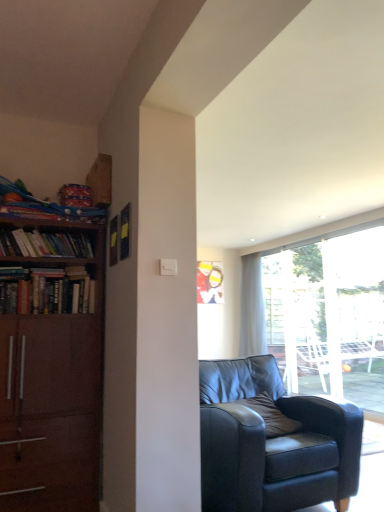
Consider the image. What is the approximate height of white sheer curtain at center?

It is 1.80 meters.

Image resolution: width=384 pixels, height=512 pixels. I want to click on hardcover books at left, which ranks as the first book in top-to-bottom order, so click(44, 244).

Measure the distance between wooden bookshelf at left, positioned as the 2th book in top-to-bottom order, and camera.

8.45 feet.

Find the location of a particular element. The image size is (384, 512). white sheer curtain at center is located at coordinates (252, 308).

Which is less distant, (221, 508) or (85, 249)?

Point (221, 508)

Can you confirm if matte black armchair at center is shorter than hardcover books at left, which is the second book in bottom-to-top order?

Incorrect, the height of matte black armchair at center does not fall short of that of hardcover books at left, which is the second book in bottom-to-top order.

Which is more to the right, matte black armchair at center or hardcover books at left, which ranks as the first book in top-to-bottom order?

matte black armchair at center is more to the right.

Between matte black armchair at center and hardcover books at left, which is the second book in bottom-to-top order, which one has larger size?

Bigger between the two is matte black armchair at center.

From a real-world perspective, is white sheer curtain at center physically located above or below hardcover books at left, which is the second book in bottom-to-top order?

Clearly, from a real-world perspective, white sheer curtain at center is below hardcover books at left, which is the second book in bottom-to-top order.

From the picture: Is white sheer curtain at center oriented towards hardcover books at left, which is the second book in bottom-to-top order?

No, white sheer curtain at center is not oriented towards hardcover books at left, which is the second book in bottom-to-top order.

Between point (252, 320) and point (34, 242), which one is positioned behind?

The point (252, 320) is more distant.

Is white sheer curtain at center next to hardcover books at left, which is the second book in bottom-to-top order?

No, white sheer curtain at center is not next to hardcover books at left, which is the second book in bottom-to-top order.

Between brown leather pillow at center and white sheer curtain at center, which one appears on the left side from the viewer's perspective?

Positioned to the left is brown leather pillow at center.

From the image's perspective, is brown leather pillow at center on white sheer curtain at center?

No.

Looking at this image, is brown leather pillow at center placed right next to white sheer curtain at center?

brown leather pillow at center and white sheer curtain at center are not in contact.

Could you tell me if brown leather pillow at center is facing white sheer curtain at center?

No.

Is hardcover books at left, which ranks as the first book in top-to-bottom order, positioned with its back to wooden bookshelf at left, which is the 1th book in bottom-to-top order?

No, wooden bookshelf at left, which is the 1th book in bottom-to-top order, is not at the back of hardcover books at left, which ranks as the first book in top-to-bottom order.

Where is `book to the right of hardcover books at left, which ranks as the first book in top-to-bottom order`? book to the right of hardcover books at left, which ranks as the first book in top-to-bottom order is located at coordinates (45, 291).

Is wooden bookshelf at left, which is the 1th book in bottom-to-top order, surrounded by hardcover books at left, which ranks as the first book in top-to-bottom order?

No.

Based on the photo, between wooden bookshelf at left, which is the 1th book in bottom-to-top order, and brown leather pillow at center, which one has larger size?

wooden bookshelf at left, which is the 1th book in bottom-to-top order.

Can you confirm if wooden bookshelf at left, which is the 1th book in bottom-to-top order, is positioned to the right of brown leather pillow at center?

No, wooden bookshelf at left, which is the 1th book in bottom-to-top order, is not to the right of brown leather pillow at center.

Considering the sizes of objects wooden bookshelf at left, positioned as the 2th book in top-to-bottom order, and brown leather pillow at center in the image provided, who is wider, wooden bookshelf at left, positioned as the 2th book in top-to-bottom order, or brown leather pillow at center?

With larger width is brown leather pillow at center.

From the picture: Is wooden bookshelf at left, which is the 1th book in bottom-to-top order, shorter than brown leather pillow at center?

Incorrect, the height of wooden bookshelf at left, which is the 1th book in bottom-to-top order, does not fall short of that of brown leather pillow at center.

Considering the sizes of matte black armchair at center and brown leather pillow at center in the image, is matte black armchair at center taller or shorter than brown leather pillow at center?

Considering their sizes, matte black armchair at center has more height than brown leather pillow at center.

Is matte black armchair at center touching brown leather pillow at center?

No, matte black armchair at center is not touching brown leather pillow at center.

From the image's perspective, which is below, matte black armchair at center or brown leather pillow at center?

From the image's view, matte black armchair at center is below.

What's the angular difference between matte black armchair at center and brown leather pillow at center's facing directions?

There is a 5.37-degree angle between the facing directions of matte black armchair at center and brown leather pillow at center.

From the image's perspective, would you say matte black armchair at center is shown under wooden bookshelf at left, which is the 1th book in bottom-to-top order?

Indeed, from the image's perspective, matte black armchair at center is shown beneath wooden bookshelf at left, which is the 1th book in bottom-to-top order.

Between matte black armchair at center and wooden bookshelf at left, which is the 1th book in bottom-to-top order, which one appears on the right side from the viewer's perspective?

Positioned to the right is matte black armchair at center.

Which of these two, matte black armchair at center or wooden bookshelf at left, which is the 1th book in bottom-to-top order, is smaller?

wooden bookshelf at left, which is the 1th book in bottom-to-top order, is smaller.

In order to click on chair lying below the hardcover books at left, which ranks as the first book in top-to-bottom order (from the image's perspective) in this screenshot , I will do `click(273, 442)`.

This screenshot has height=512, width=384. What are the coordinates of `the 2nd book above when counting from the white sheer curtain at center (from the image's perspective)` in the screenshot? It's located at (44, 244).

Looking at the image, which one is located closer to brown leather pillow at center, hardcover books at left, which ranks as the first book in top-to-bottom order, or white sheer curtain at center?

hardcover books at left, which ranks as the first book in top-to-bottom order, is positioned closer to the anchor brown leather pillow at center.

Based on their spatial positions, is hardcover books at left, which ranks as the first book in top-to-bottom order, or brown leather pillow at center closer to matte black armchair at center?

Among the two, brown leather pillow at center is located nearer to matte black armchair at center.

Looking at the image, which one is located closer to matte black armchair at center, wooden bookshelf at left, positioned as the 2th book in top-to-bottom order, or white sheer curtain at center?

wooden bookshelf at left, positioned as the 2th book in top-to-bottom order, is positioned closer to the anchor matte black armchair at center.

Which object lies nearer to the anchor point hardcover books at left, which is the second book in bottom-to-top order, wooden bookshelf at left, positioned as the 2th book in top-to-bottom order, or white sheer curtain at center?

Among the two, wooden bookshelf at left, positioned as the 2th book in top-to-bottom order, is located nearer to hardcover books at left, which is the second book in bottom-to-top order.

Estimate the real-world distances between objects in this image. Which object is closer to matte black armchair at center, brown leather pillow at center or wooden bookshelf at left, which is the 1th book in bottom-to-top order?

brown leather pillow at center is closer to matte black armchair at center.

Looking at the image, which one is located further to matte black armchair at center, white sheer curtain at center or wooden bookshelf at left, which is the 1th book in bottom-to-top order?

white sheer curtain at center is further to matte black armchair at center.

When comparing their distances from white sheer curtain at center, does hardcover books at left, which ranks as the first book in top-to-bottom order, or matte black armchair at center seem further?

hardcover books at left, which ranks as the first book in top-to-bottom order, is positioned further to the anchor white sheer curtain at center.

Considering their positions, is hardcover books at left, which is the second book in bottom-to-top order, positioned further to wooden bookshelf at left, which is the 1th book in bottom-to-top order, than matte black armchair at center?

Based on the image, matte black armchair at center appears to be further to wooden bookshelf at left, which is the 1th book in bottom-to-top order.

Locate an element on the screen. pillow between matte black armchair at center and white sheer curtain at center along the z-axis is located at coordinates [271, 416].

The height and width of the screenshot is (512, 384). Find the location of `book between wooden bookshelf at left, positioned as the 2th book in top-to-bottom order, and white sheer curtain at center from front to back`. book between wooden bookshelf at left, positioned as the 2th book in top-to-bottom order, and white sheer curtain at center from front to back is located at coordinates (44, 244).

Identify the location of pillow positioned between wooden bookshelf at left, which is the 1th book in bottom-to-top order, and white sheer curtain at center from near to far. (271, 416).

Where is `book between brown leather pillow at center and white sheer curtain at center from front to back`? The image size is (384, 512). book between brown leather pillow at center and white sheer curtain at center from front to back is located at coordinates (44, 244).